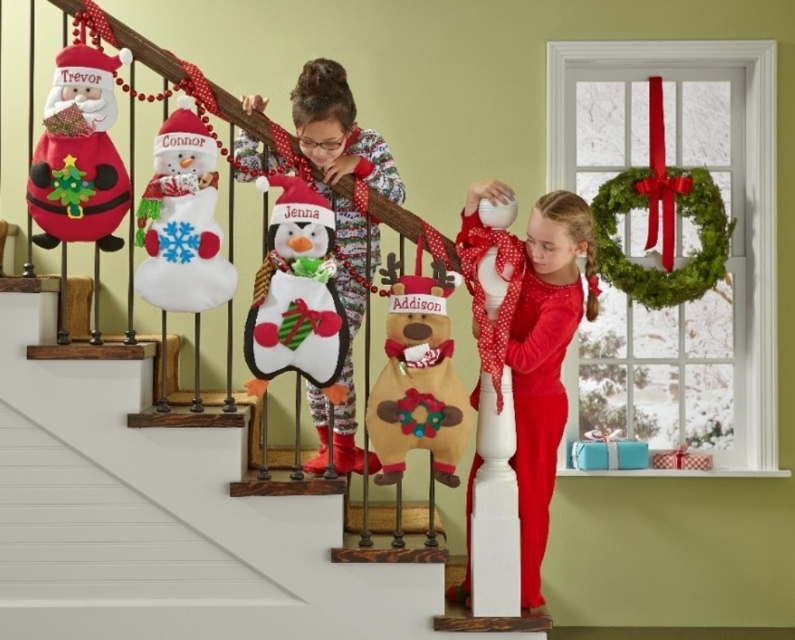
Does felt penguin at center come behind felt snowman at upper left?

No, it is not.

Between felt penguin at center and felt snowman at upper left, which one is positioned lower?

Positioned lower is felt penguin at center.

Find the location of a particular element. felt penguin at center is located at coordinates (297, 294).

Identify the location of felt penguin at center. The image size is (795, 640). (297, 294).

Between felt reindeer stocking at center and felt snowman at upper left, which one appears on the right side from the viewer's perspective?

From the viewer's perspective, felt reindeer stocking at center appears more on the right side.

Can you confirm if felt reindeer stocking at center is smaller than felt snowman at upper left?

No.

Who is more forward, (123, 458) or (64, 230)?

Positioned in front is point (64, 230).

Find the location of a particular element. The image size is (795, 640). felt reindeer stocking at center is located at coordinates (165, 518).

Between red velvet dress at center and fuzzy white penguin at center, which one is positioned higher?

fuzzy white penguin at center is above.

Identify the location of red velvet dress at center. This screenshot has height=640, width=795. pyautogui.click(x=526, y=339).

Where is `red velvet dress at center`? This screenshot has width=795, height=640. red velvet dress at center is located at coordinates (526, 339).

Find the location of a particular element. red velvet dress at center is located at coordinates (526, 339).